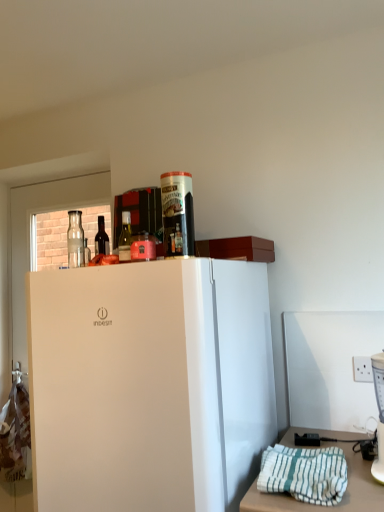
Question: Visually, is dark glass bottle at upper left, arranged as the 1th bottle when viewed from the left, positioned to the left or to the right of white matte refrigerator at center?

Choices:
 (A) right
 (B) left

Answer: (B)

Question: In the image, is dark glass bottle at upper left, arranged as the 1th bottle when viewed from the left, positioned in front of or behind white matte refrigerator at center?

Choices:
 (A) behind
 (B) front

Answer: (A)

Question: Based on their relative distances, which object is nearer to the white matte refrigerator at center?

Choices:
 (A) dark glass bottle at upper left, acting as the 1th bottle starting from the back
 (B) matte glass bottle at upper center, marked as the 1th bottle in a front-to-back arrangement
 (C) white plastic blender at right
 (D) transparent glass door at upper left
 (E) white striped towel at lower right

Answer: (E)

Question: Based on their relative distances, which object is nearer to the matte glass bottle at upper center, which is counted as the second bottle, starting from the left?

Choices:
 (A) dark glass bottle at upper left, acting as the 1th bottle starting from the back
 (B) transparent glass door at upper left
 (C) white striped towel at lower right
 (D) white plastic blender at right
 (E) white matte refrigerator at center

Answer: (A)